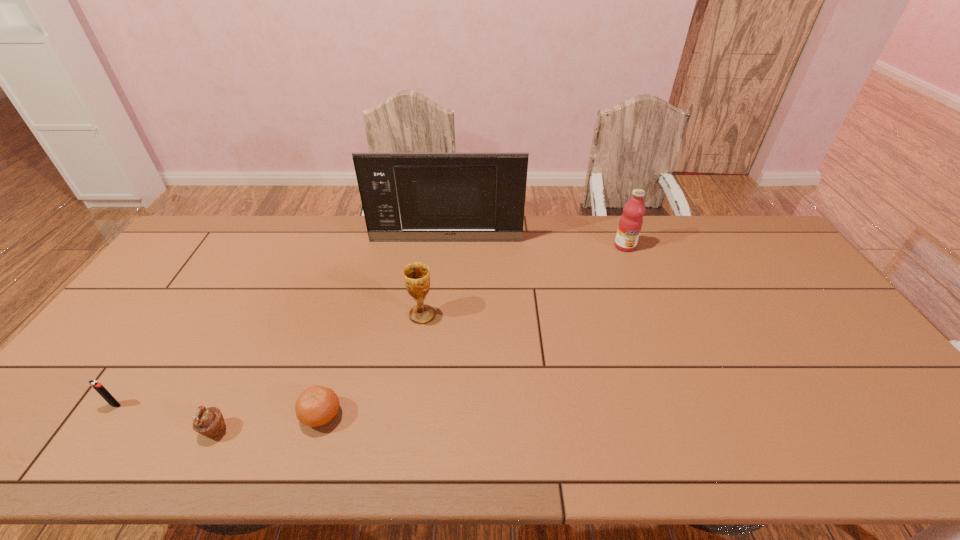
Find the location of a particular element. The width and height of the screenshot is (960, 540). vacant region between the tallest object and the muffin is located at coordinates (330, 335).

At what (x,y) coordinates should I click in order to perform the action: click on object that stands as the fifth closest to the leftmost object. Please return your answer as a coordinate pair (x, y). This screenshot has width=960, height=540. Looking at the image, I should click on (631, 221).

At what (x,y) coordinates should I click in order to perform the action: click on object that is the third closest to the chalice. Please return your answer as a coordinate pair (x, y). Looking at the image, I should click on (209, 422).